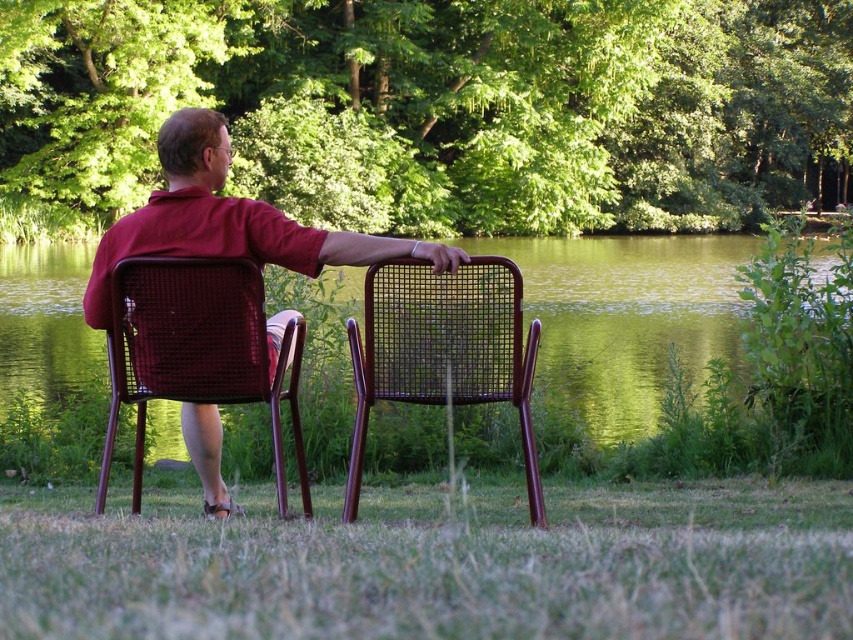
Question: Is brown wicker chair at left to the left of matte wicker chair at center from the viewer's perspective?

Choices:
 (A) no
 (B) yes

Answer: (B)

Question: Can you confirm if matte wicker chair at center is positioned above brown wicker chair at center?

Choices:
 (A) no
 (B) yes

Answer: (B)

Question: Which of the following is the farthest from the observer?

Choices:
 (A) matte wicker chair at center
 (B) brown wicker chair at left
 (C) brown wicker chair at center

Answer: (C)

Question: Which of these objects is positioned farthest from the brown wicker chair at center?

Choices:
 (A) brown wicker chair at left
 (B) matte wicker chair at center

Answer: (B)

Question: Can you confirm if brown wicker chair at left is positioned below matte wicker chair at center?

Choices:
 (A) no
 (B) yes

Answer: (B)

Question: Which point is closer to the camera taking this photo?

Choices:
 (A) (178, 136)
 (B) (106, 337)
 (C) (15, 305)
 (D) (347, 330)

Answer: (A)